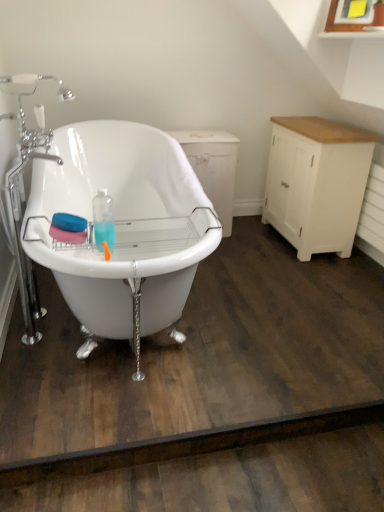
The height and width of the screenshot is (512, 384). I want to click on free space in front of white painted wood cabinet at right, so click(307, 274).